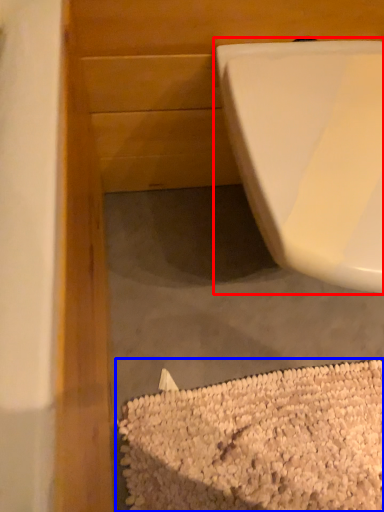
Question: Which of the following is the farthest to the observer, toilet (highlighted by a red box) or debris (highlighted by a blue box)?

Choices:
 (A) toilet
 (B) debris

Answer: (B)